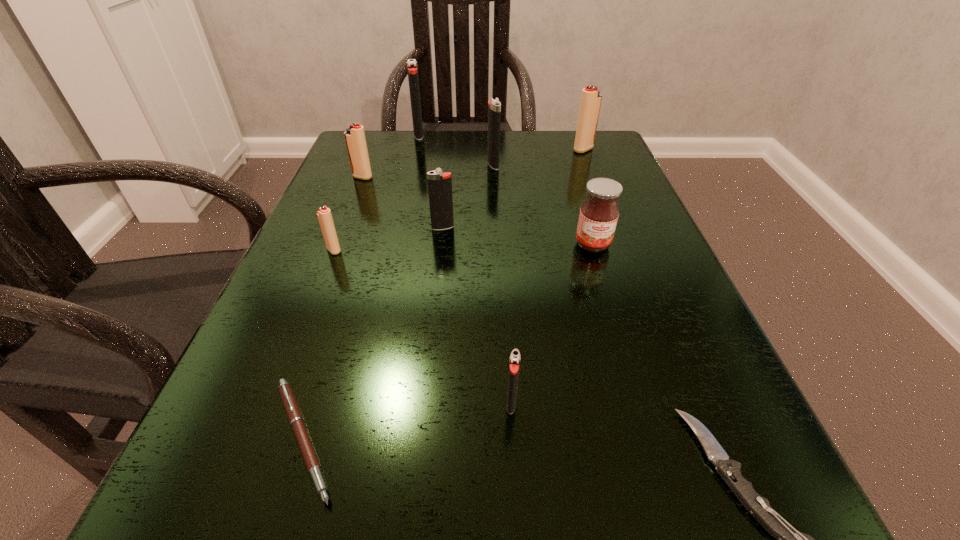
Locate an element on the screen. jam is located at coordinates (599, 213).

What are the coordinates of `the smallest red igniter` in the screenshot? It's located at (324, 215).

At what (x,y) coordinates should I click in order to perform the action: click on the sixth farthest igniter. Please return your answer as a coordinate pair (x, y). Looking at the image, I should click on (324, 215).

This screenshot has height=540, width=960. Find the location of `the nearest black igniter`. the nearest black igniter is located at coordinates (514, 365).

The width and height of the screenshot is (960, 540). Find the location of `the smallest black igniter`. the smallest black igniter is located at coordinates (514, 365).

The height and width of the screenshot is (540, 960). I want to click on pink pen, so click(x=296, y=420).

Where is `vacant space located on the front of the fifth igniter from right to left`? vacant space located on the front of the fifth igniter from right to left is located at coordinates (397, 221).

I want to click on free location located 0.140m on the front of the sixth nearest igniter, so click(596, 185).

Where is `vacant space positioned 0.050m on the left of the fifth nearest igniter`? vacant space positioned 0.050m on the left of the fifth nearest igniter is located at coordinates (466, 165).

Where is `vacant space situated 0.320m on the front of the fifth object from left to right`? The height and width of the screenshot is (540, 960). vacant space situated 0.320m on the front of the fifth object from left to right is located at coordinates (427, 375).